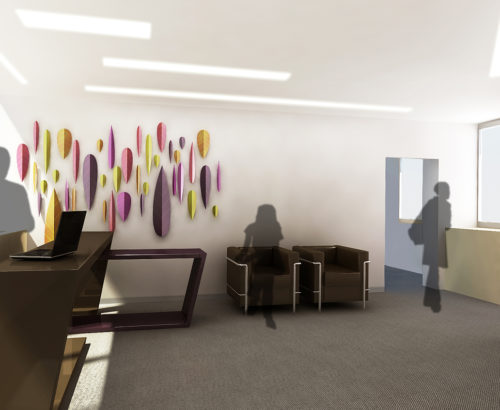
Find the location of a particular element. The width and height of the screenshot is (500, 410). wall is located at coordinates (318, 161).